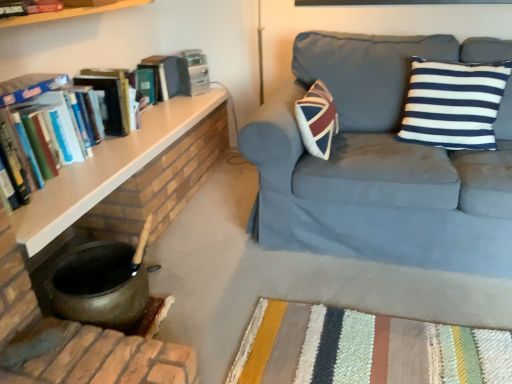
At what (x,y) coordinates should I click in order to perform the action: click on empty space that is ontop of hardcover book at upper left (from a real-world perspective). Please return your answer as a coordinate pair (x, y). Image resolution: width=512 pixels, height=384 pixels. Looking at the image, I should click on (158, 59).